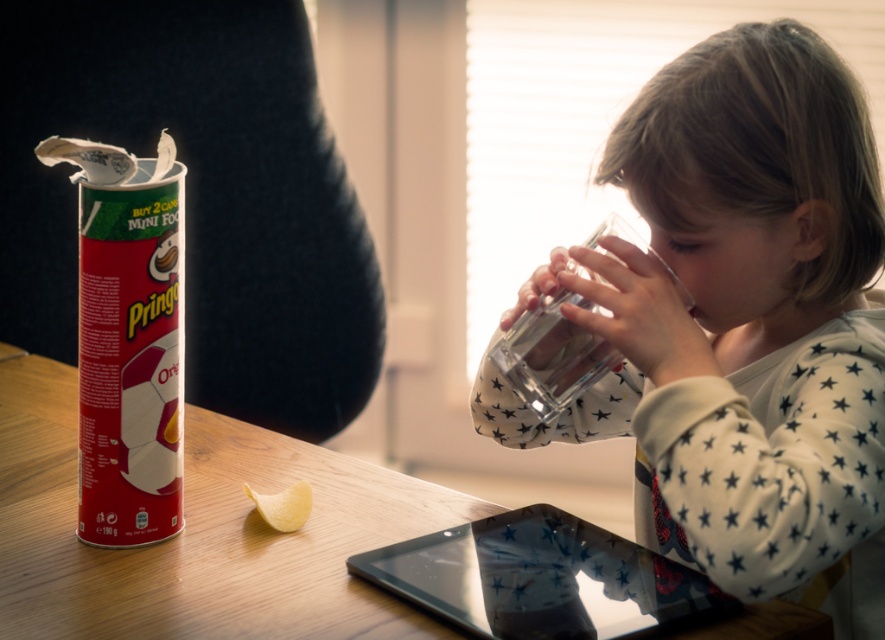
Between white star-patterned shirt at upper right and wooden table at center, which one has less height?

wooden table at center is shorter.

At what (x,y) coordinates should I click in order to perform the action: click on white star-patterned shirt at upper right. Please return your answer as a coordinate pair (x, y). This screenshot has height=640, width=885. Looking at the image, I should click on (743, 324).

Between shiny metallic pringles can at left and transparent glass tablet at lower center, which one is positioned lower?

transparent glass tablet at lower center is lower down.

Is shiny metallic pringles can at left positioned at the back of transparent glass tablet at lower center?

Yes, it is.

What do you see at coordinates (129, 358) in the screenshot? The height and width of the screenshot is (640, 885). I see `shiny metallic pringles can at left` at bounding box center [129, 358].

Find the location of a particular element. shiny metallic pringles can at left is located at coordinates (129, 358).

Is wooden table at center below transparent glass tablet at lower center?

No, wooden table at center is not below transparent glass tablet at lower center.

Can you confirm if wooden table at center is positioned to the left of transparent glass tablet at lower center?

Indeed, wooden table at center is positioned on the left side of transparent glass tablet at lower center.

Who is more distant from viewer, [327,468] or [635,628]?

Positioned behind is point [327,468].

Locate an element on the screen. Image resolution: width=885 pixels, height=640 pixels. wooden table at center is located at coordinates (201, 532).